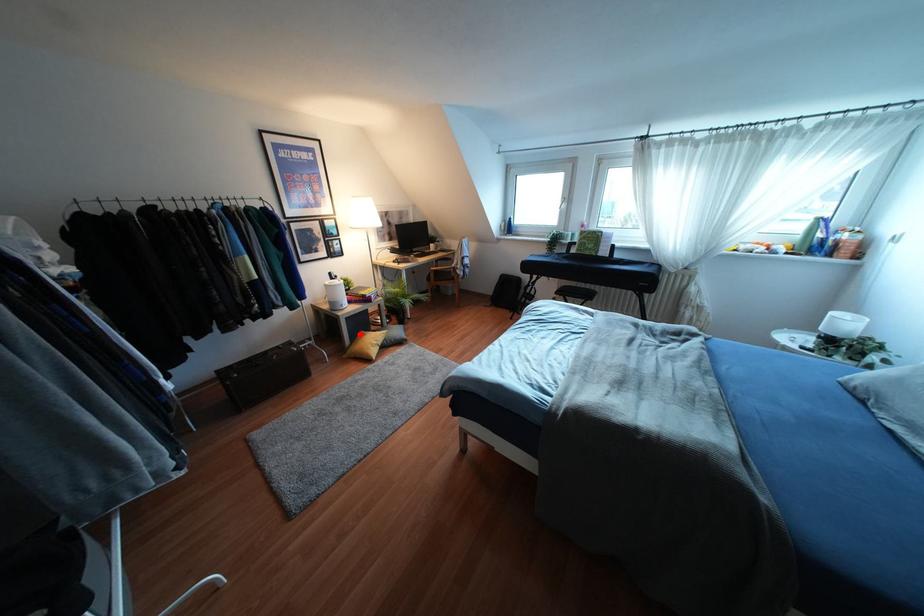
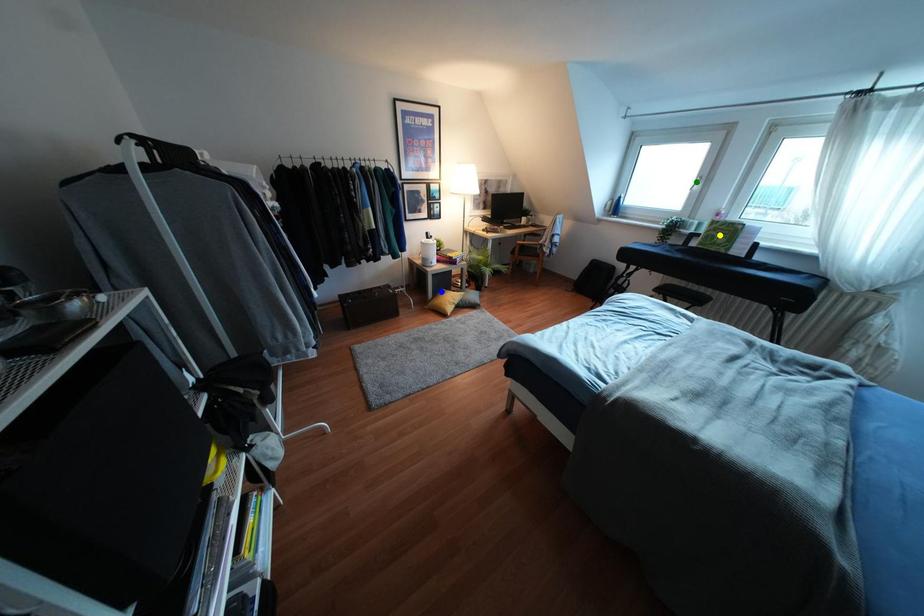
Question: I am providing you with two images of the same scene from different viewpoints. A red point is marked on the first image. You are given multiple points on the second image. Can you choose the point in image 2 that corresponds to the point in image 1?

Choices:
 (A) yellow point
 (B) blue point
 (C) green point

Answer: (B)